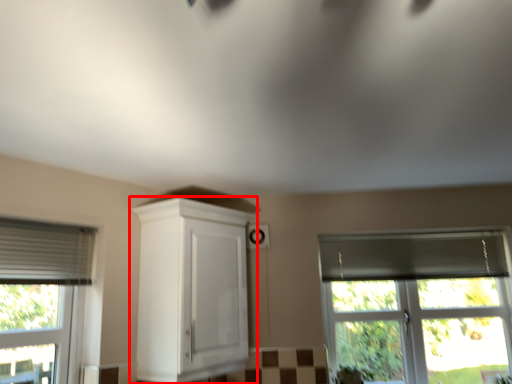
Question: In this image, where is cabinetry (annotated by the red box) located relative to window?

Choices:
 (A) left
 (B) right

Answer: (A)